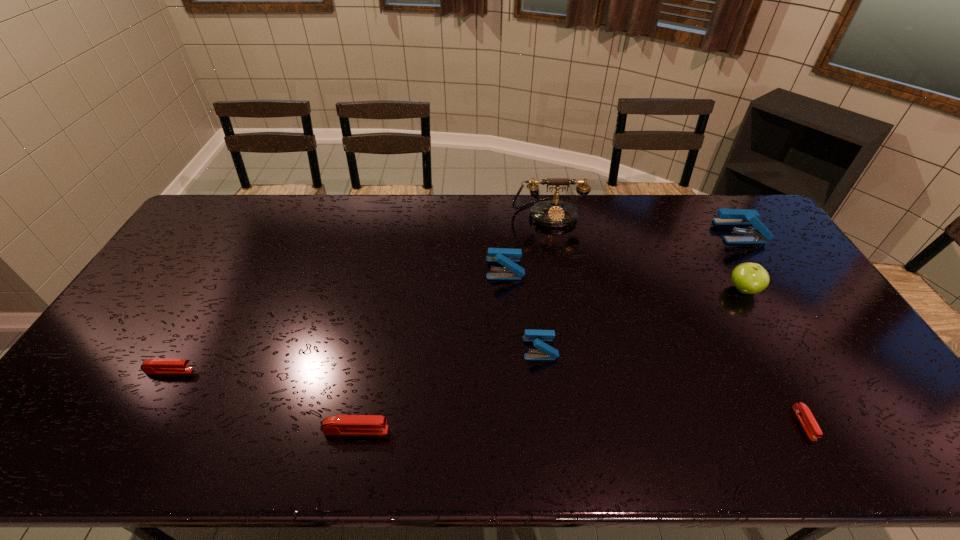
Find the location of `red stapler object that ranks as the second closest to the biggest red stapler`. red stapler object that ranks as the second closest to the biggest red stapler is located at coordinates pos(803,413).

Find the location of a particular element. This screenshot has height=540, width=960. the third closest red stapler to the rightmost stapler is located at coordinates (151, 366).

The height and width of the screenshot is (540, 960). I want to click on free point that satisfies the following two spatial constraints: 1. on the front side of the green apple; 2. on the front-facing side of the third nearest stapler, so click(x=790, y=371).

Find the location of `vacant space that satisfies the following two spatial constraints: 1. on the dial of the telephone; 2. on the right side of the farthest stapler`. vacant space that satisfies the following two spatial constraints: 1. on the dial of the telephone; 2. on the right side of the farthest stapler is located at coordinates (551, 232).

Locate an element on the screen. Image resolution: width=960 pixels, height=540 pixels. blank area in the image that satisfies the following two spatial constraints: 1. on the front side of the fifth farthest object; 2. on the front-facing side of the leftmost stapler is located at coordinates (542, 371).

Locate an element on the screen. vacant space that satisfies the following two spatial constraints: 1. on the back side of the smallest blue stapler; 2. on the right side of the green apple is located at coordinates (533, 289).